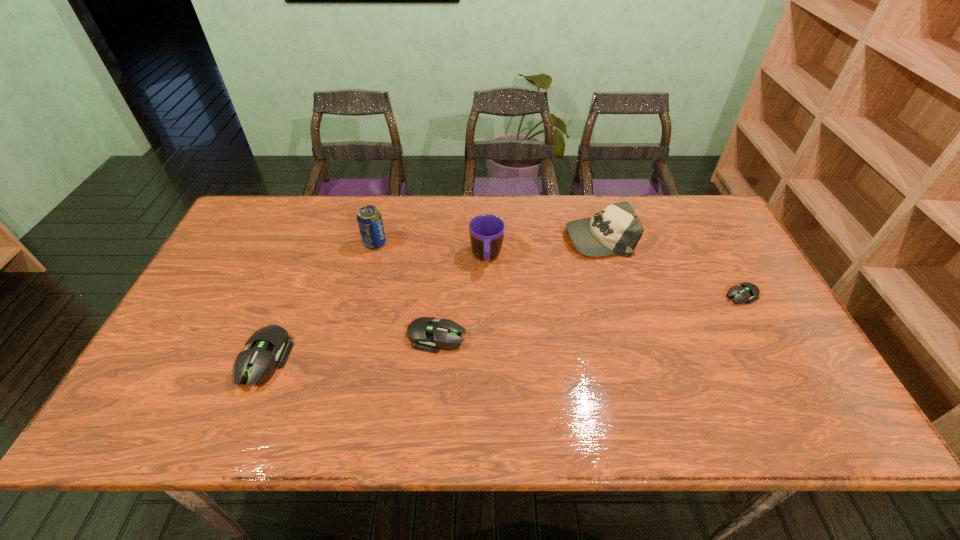
The height and width of the screenshot is (540, 960). I want to click on the leftmost object, so click(x=255, y=366).

Where is `the second shortest object`? the second shortest object is located at coordinates (425, 334).

Locate an element on the screen. the fourth object from right to left is located at coordinates (425, 334).

Identify the location of the farthest computer mouse. (745, 292).

At what (x,y) coordinates should I click in order to perform the action: click on the rightmost object. Please return your answer as a coordinate pair (x, y). Looking at the image, I should click on (745, 292).

Identify the location of baseball cap. This screenshot has width=960, height=540. (616, 230).

The height and width of the screenshot is (540, 960). I want to click on the fourth shortest object, so click(616, 230).

You are a GUI agent. You are given a task and a screenshot of the screen. Output one action in this format:
    pyautogui.click(x=<x>, y=<y>)
    Task: Click on the second object from left to right
    
    Given the screenshot: What is the action you would take?
    pyautogui.click(x=369, y=219)

Locate an element on the screen. the third object from right to left is located at coordinates (486, 231).

What are the coordinates of `free space located 0.200m on the right of the leftmost computer mouse` in the screenshot? It's located at (372, 360).